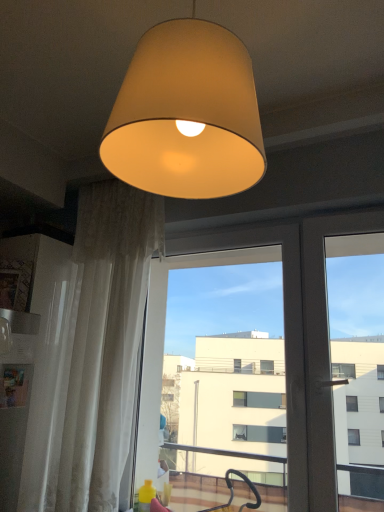
This screenshot has width=384, height=512. Describe the element at coordinates (295, 334) in the screenshot. I see `transparent glass screen door at center` at that location.

Identify the location of white sheer curtain at left. (92, 353).

In order to face white sheer curtain at left, should I rotate leftwards or rightwards?

You should look left and rotate roughly 11.016 degrees.

At what (x,y) coordinates should I click in order to perform the action: click on transparent glass screen door at center. Please return your answer as a coordinate pair (x, y). The height and width of the screenshot is (512, 384). Looking at the image, I should click on (295, 334).

Looking at this image, does matte beige lampshade at upper center have a smaller size compared to transparent glass screen door at center?

Correct, matte beige lampshade at upper center occupies less space than transparent glass screen door at center.

Which is correct: matte beige lampshade at upper center is inside transparent glass screen door at center, or outside of it?

The correct answer is: outside.

Could you tell me if matte beige lampshade at upper center is turned towards transparent glass screen door at center?

No, matte beige lampshade at upper center is not facing towards transparent glass screen door at center.

This screenshot has width=384, height=512. What are the coordinates of `lamp that appears on the left of transparent glass screen door at center` in the screenshot? It's located at click(x=186, y=115).

You are a GUI agent. You are given a task and a screenshot of the screen. Output one action in this format:
    pyautogui.click(x=<x>, y=<y>)
    Task: Click on the screen door beneath the white sheer curtain at left (from a real-world perspective)
    The height and width of the screenshot is (512, 384).
    Given the screenshot: What is the action you would take?
    pyautogui.click(x=295, y=334)

Considering the sizes of objects transparent glass screen door at center and white sheer curtain at left in the image provided, who is thinner, transparent glass screen door at center or white sheer curtain at left?

white sheer curtain at left is thinner.

Can you confirm if transparent glass screen door at center is positioned to the right of white sheer curtain at left?

Correct, you'll find transparent glass screen door at center to the right of white sheer curtain at left.

Between transparent glass screen door at center and white sheer curtain at left, which one has smaller size?

white sheer curtain at left is smaller.

Which of these two, white sheer curtain at left or matte beige lampshade at upper center, stands shorter?

Standing shorter between the two is matte beige lampshade at upper center.

Does point (97, 419) come closer to viewer compared to point (257, 180)?

No, it is behind (257, 180).

How much distance is there between white sheer curtain at left and matte beige lampshade at upper center?

white sheer curtain at left is 1.01 meters from matte beige lampshade at upper center.

Is white sheer curtain at left wider or thinner than matte beige lampshade at upper center?

Clearly, white sheer curtain at left has less width compared to matte beige lampshade at upper center.

Is white sheer curtain at left not near transparent glass screen door at center?

No, white sheer curtain at left is in close proximity to transparent glass screen door at center.

Which point is more distant from viewer, (71, 449) or (302, 330)?

Point (302, 330)

What's the angular difference between white sheer curtain at left and transparent glass screen door at center's facing directions?

0.0452 degrees separate the facing orientations of white sheer curtain at left and transparent glass screen door at center.

Which object is positioned more to the right, white sheer curtain at left or transparent glass screen door at center?

Positioned to the right is transparent glass screen door at center.

Where is `lamp in front of the white sheer curtain at left`? lamp in front of the white sheer curtain at left is located at coordinates pos(186,115).

Considering the sizes of objects matte beige lampshade at upper center and white sheer curtain at left in the image provided, who is smaller, matte beige lampshade at upper center or white sheer curtain at left?

matte beige lampshade at upper center is smaller.

Do you think matte beige lampshade at upper center is within white sheer curtain at left, or outside of it?

matte beige lampshade at upper center is spatially situated outside white sheer curtain at left.

Is transparent glass screen door at center touching matte beige lampshade at upper center?

No, transparent glass screen door at center is not making contact with matte beige lampshade at upper center.

In the image, is transparent glass screen door at center positioned in front of or behind matte beige lampshade at upper center?

transparent glass screen door at center is positioned farther from the viewer than matte beige lampshade at upper center.

Locate an element on the screen. screen door lying behind the matte beige lampshade at upper center is located at coordinates (295, 334).

What are the coordinates of `screen door below the matte beige lampshade at upper center (from the image's perspective)` in the screenshot? It's located at (295, 334).

Locate an element on the screen. screen door lying in front of the white sheer curtain at left is located at coordinates (295, 334).

Looking at the image, which one is located further to transparent glass screen door at center, white sheer curtain at left or matte beige lampshade at upper center?

matte beige lampshade at upper center is further to transparent glass screen door at center.

Considering their positions, is matte beige lampshade at upper center positioned closer to white sheer curtain at left than transparent glass screen door at center?

Among the two, transparent glass screen door at center is located nearer to white sheer curtain at left.

Considering their positions, is transparent glass screen door at center positioned closer to matte beige lampshade at upper center than white sheer curtain at left?

Based on the image, white sheer curtain at left appears to be nearer to matte beige lampshade at upper center.

When comparing their distances from transparent glass screen door at center, does matte beige lampshade at upper center or white sheer curtain at left seem closer?

white sheer curtain at left is positioned closer to the anchor transparent glass screen door at center.

Estimate the real-world distances between objects in this image. Which object is closer to matte beige lampshade at upper center, white sheer curtain at left or transparent glass screen door at center?

white sheer curtain at left.

Considering their positions, is transparent glass screen door at center positioned closer to white sheer curtain at left than matte beige lampshade at upper center?

Among the two, transparent glass screen door at center is located nearer to white sheer curtain at left.

Locate an element on the screen. The image size is (384, 512). curtain between matte beige lampshade at upper center and transparent glass screen door at center in the vertical direction is located at coordinates (92, 353).